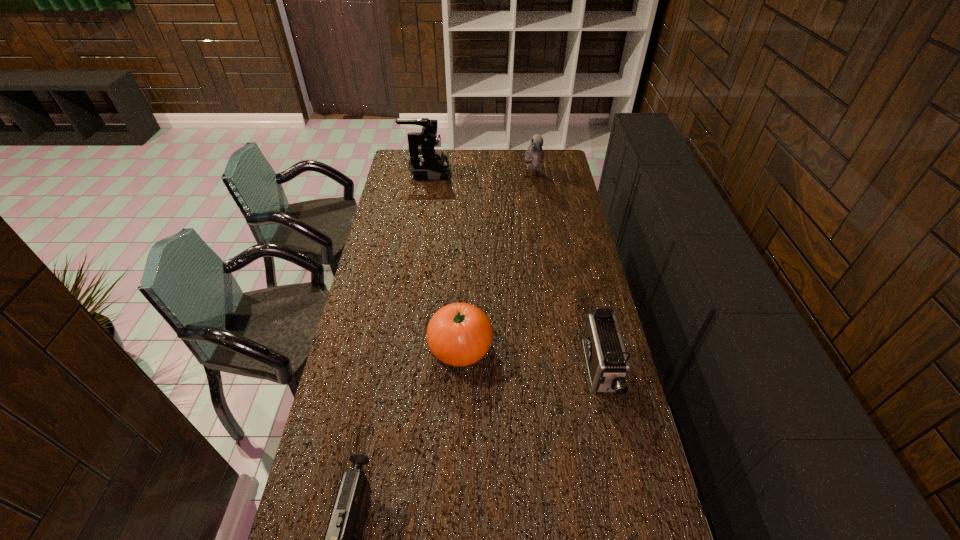
This screenshot has height=540, width=960. In order to click on vacant space that is in between the fourth object from left to right and the pumpkin in this screenshot , I will do `click(496, 262)`.

I want to click on vacant point located between the fourth object from left to right and the farthest camcorder, so click(479, 176).

Find the location of a particular element. The height and width of the screenshot is (540, 960). vacant region between the second nearest camcorder and the pumpkin is located at coordinates (531, 359).

Locate an element on the screen. Image resolution: width=960 pixels, height=540 pixels. vacant space in between the farthest camcorder and the rightmost object is located at coordinates (514, 272).

Locate which object is the closest to the nearest camcorder. Please provide its 2D coordinates. Your answer should be formatted as a tuple, i.e. [(x, y)], where the tuple contains the x and y coordinates of a point satisfying the conditions above.

[(459, 334)]

Choose which object is the nearest neighbor to the rightmost object. Please provide its 2D coordinates. Your answer should be formatted as a tuple, i.e. [(x, y)], where the tuple contains the x and y coordinates of a point satisfying the conditions above.

[(459, 334)]

The width and height of the screenshot is (960, 540). Identify the location of the second closest camcorder to the second object from right to left. (x=607, y=361).

Identify which camcorder is the nearest to the pumpkin. Please provide its 2D coordinates. Your answer should be formatted as a tuple, i.e. [(x, y)], where the tuple contains the x and y coordinates of a point satisfying the conditions above.

[(607, 361)]

Image resolution: width=960 pixels, height=540 pixels. I want to click on free point that satisfies the following two spatial constraints: 1. on the lens mount of the pumpkin; 2. on the right side of the farthest camcorder, so click(399, 347).